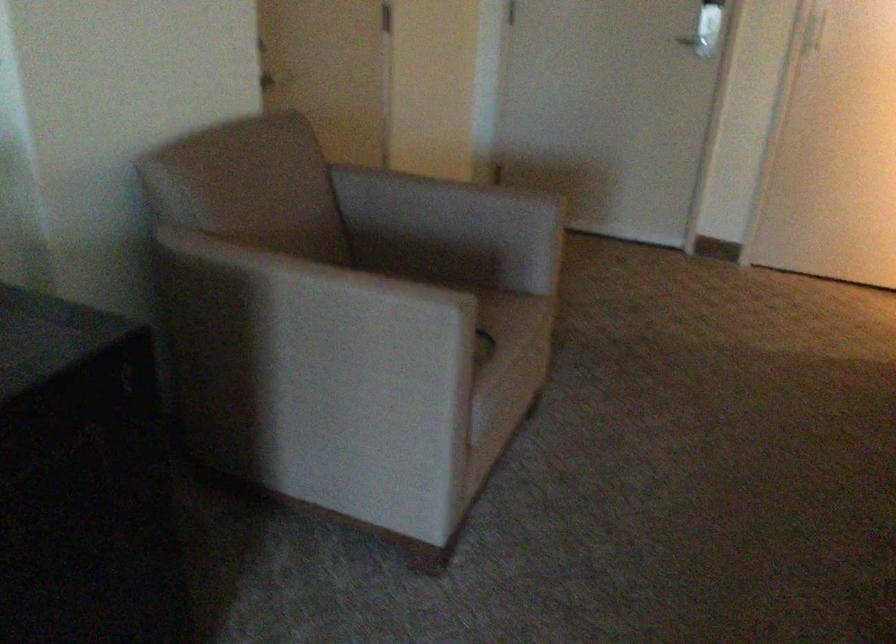
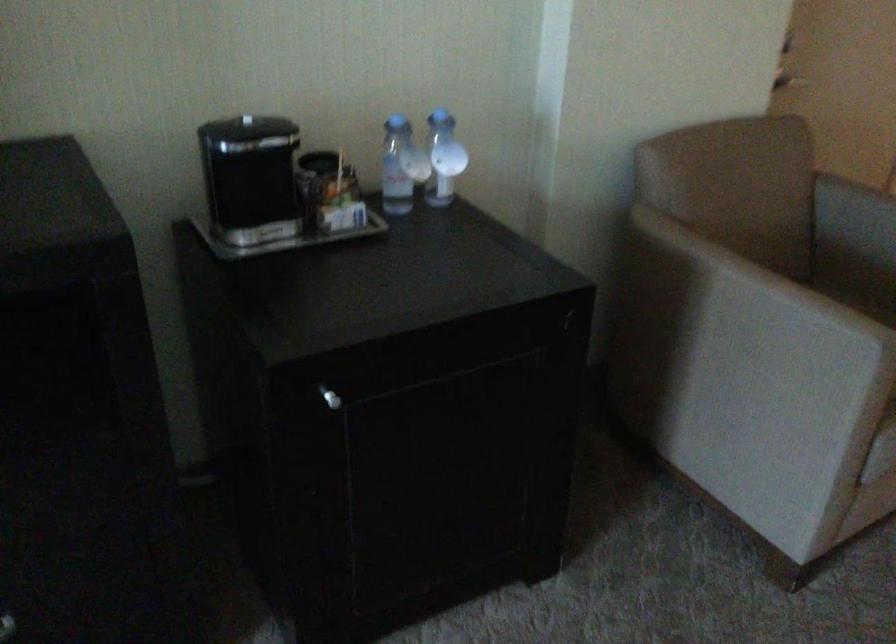
Locate, in the second image, the point that corresponds to pixel 316 324 in the first image.

(739, 319)